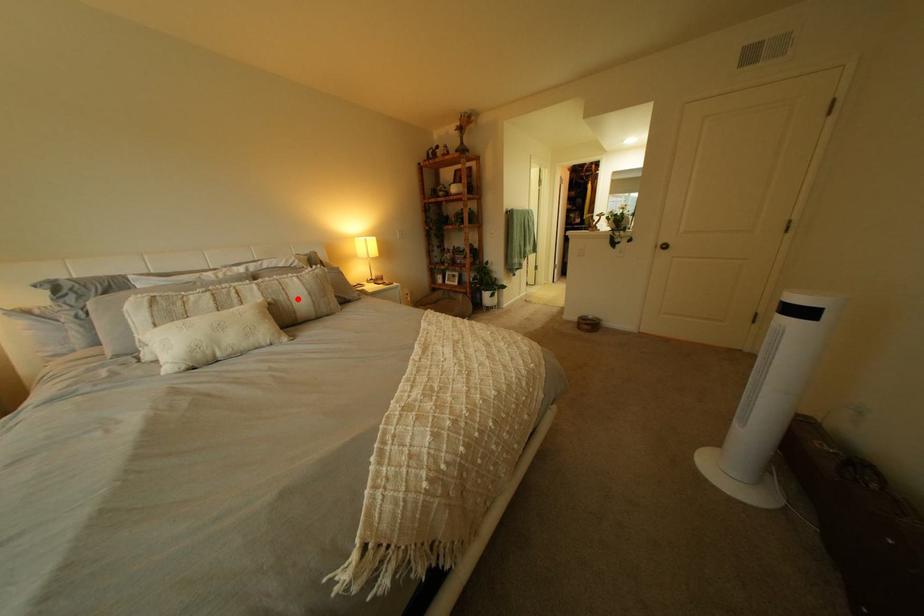
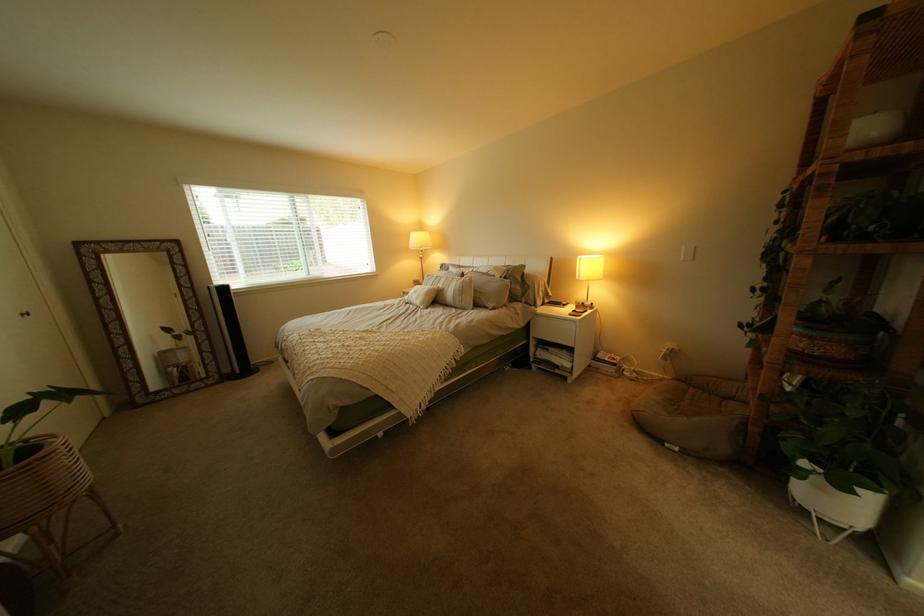
Find the pixel in the second image that matches the highlighted location in the first image.

(462, 290)